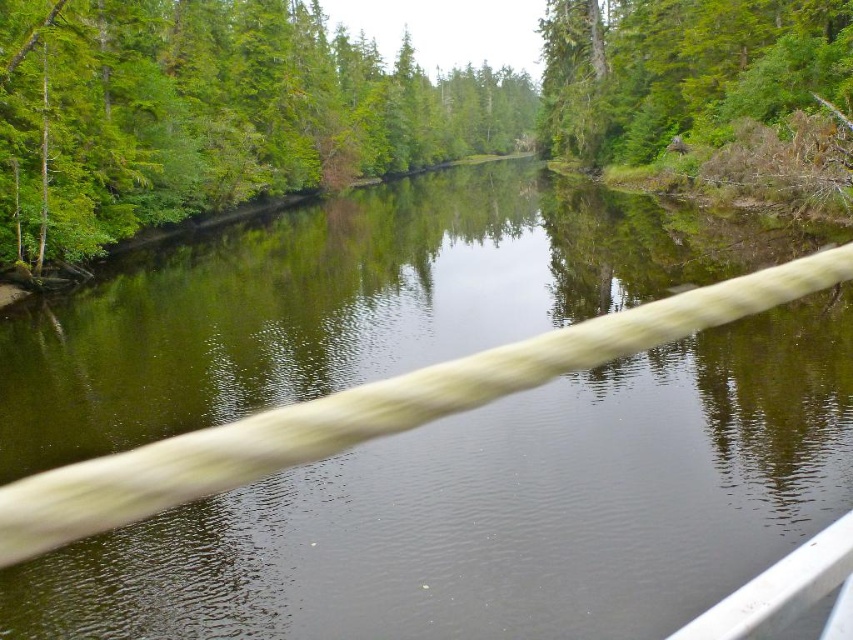
You are a bird looking for a place to perch. You see a green leafy tree at upper left and a green rough bark tree at upper right. Which tree is located above the other?

The green leafy tree at upper left is positioned over the green rough bark tree at upper right.

You are a hiker standing at the center of the riverbank. You need to locate the green leafy tree at upper left. According to the coordinates provided, where exactly is it positioned?

The green leafy tree at upper left is located at coordinates point (212,115).